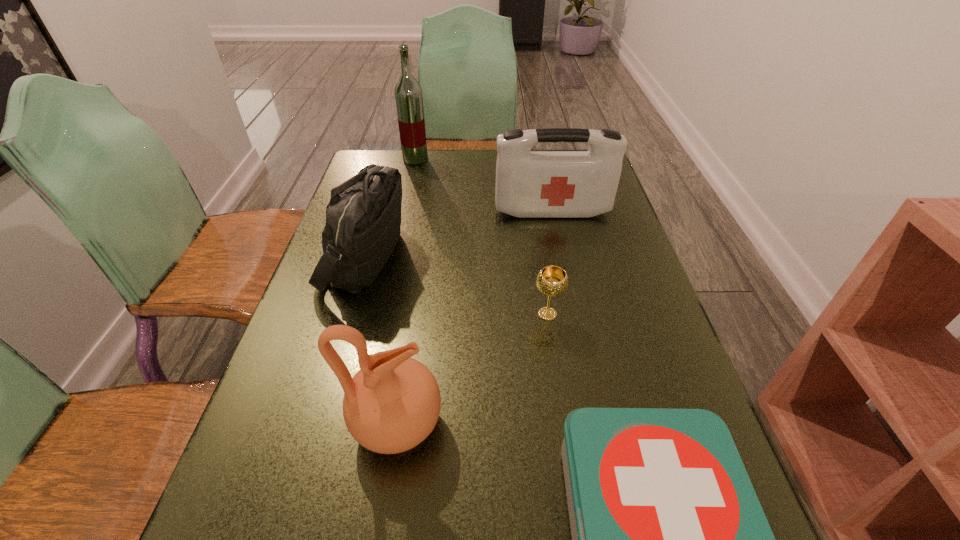
Locate an element on the screen. The image size is (960, 540). vacant area between the chalice and the shoulder bag is located at coordinates (456, 285).

Where is `unoccupied area between the farther first-aid kit and the shoulder bag`? This screenshot has height=540, width=960. unoccupied area between the farther first-aid kit and the shoulder bag is located at coordinates (459, 234).

Image resolution: width=960 pixels, height=540 pixels. Identify the location of vacant space that is in between the pottery and the chalice. (472, 369).

Where is `free space between the pottery and the taller first-aid kit`? The width and height of the screenshot is (960, 540). free space between the pottery and the taller first-aid kit is located at coordinates (475, 318).

Locate an element on the screen. This screenshot has height=540, width=960. free space between the farthest object and the chalice is located at coordinates (482, 237).

What are the coordinates of `object that is the closest to the nearer first-aid kit` in the screenshot? It's located at (392, 404).

Identify which object is located as the third nearest to the farther first-aid kit. Please provide its 2D coordinates. Your answer should be formatted as a tuple, i.e. [(x, y)], where the tuple contains the x and y coordinates of a point satisfying the conditions above.

[(552, 281)]

What are the coordinates of `free point that satisfies the following two spatial constraints: 1. on the back side of the chalice; 2. at the front padded panel of the shoulder bag` in the screenshot? It's located at (539, 256).